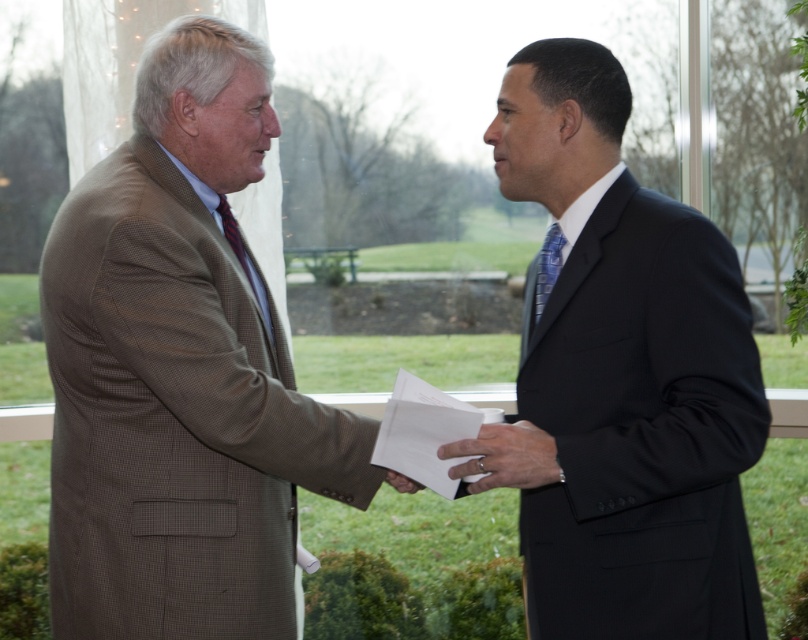
You are a tailor measuring two items in the image. The brown textured suit at left and the matte black hand at center. Which item is wider?

The brown textured suit at left is wider than the matte black hand at center, as its width surpasses the hand.

You are a photographer adjusting the focus on your camera. You need to focus on both the point at (255, 259) and the point at (617, 628). Which point should you focus on first to ensure both are in focus?

You should focus on point (255, 259) first because it is closer to the camera than point (617, 628). By focusing on the closer point, the farther point will also be in focus due to the depth of field.

You are a photographer standing at the camera position. You want to take a closeup shot of the brown textured suit at left without moving the camera. Is it possible to do so?

The brown textured suit at left is 1.67 meters away from the camera, so yes, you can take a closeup shot by adjusting the zoom lens to focus on the brown textured suit at left from that distance without moving the camera.